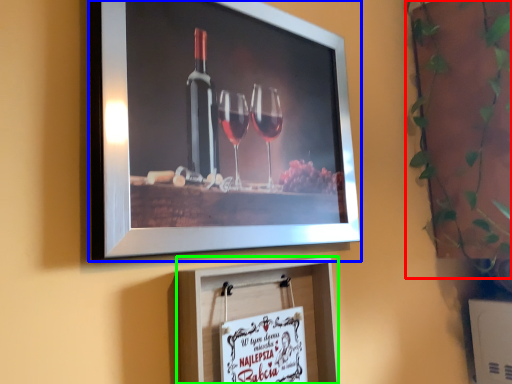
Question: Estimate the real-world distances between objects in this image. Which object is farther from plant (highlighted by a red box), picture frame (highlighted by a blue box) or picture frame (highlighted by a green box)?

Choices:
 (A) picture frame
 (B) picture frame

Answer: (B)